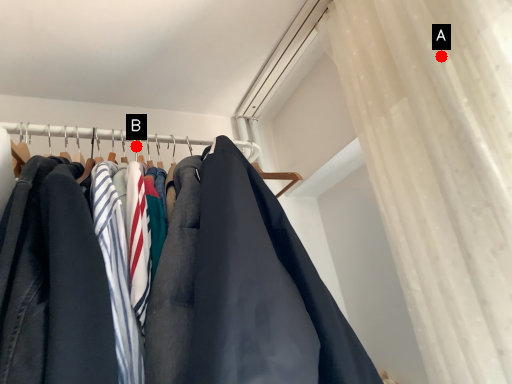
Question: Two points are circled on the image, labeled by A and B beside each circle. Which of the following is the farthest from the observer?

Choices:
 (A) A is further
 (B) B is further

Answer: (B)